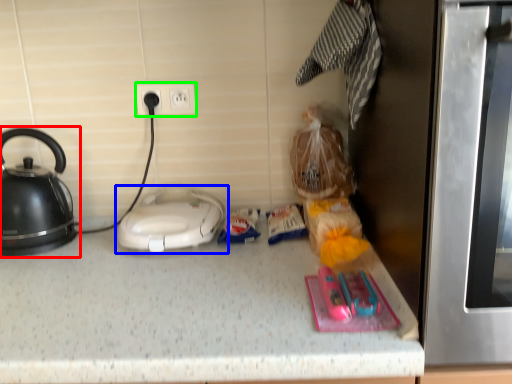
Question: Which is nearer to the kettle (highlighted by a red box)? home appliance (highlighted by a blue box) or electric outlet (highlighted by a green box).

Choices:
 (A) home appliance
 (B) electric outlet

Answer: (A)